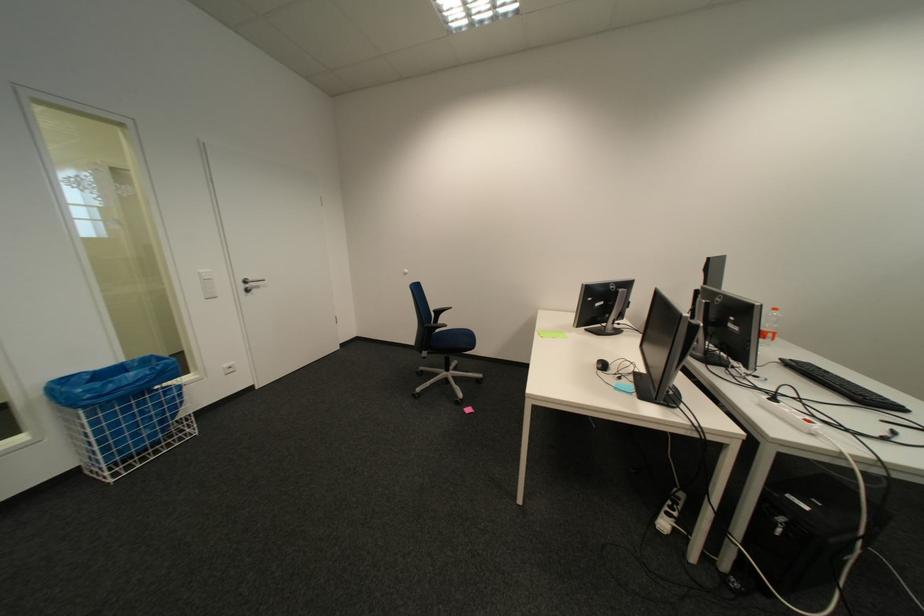
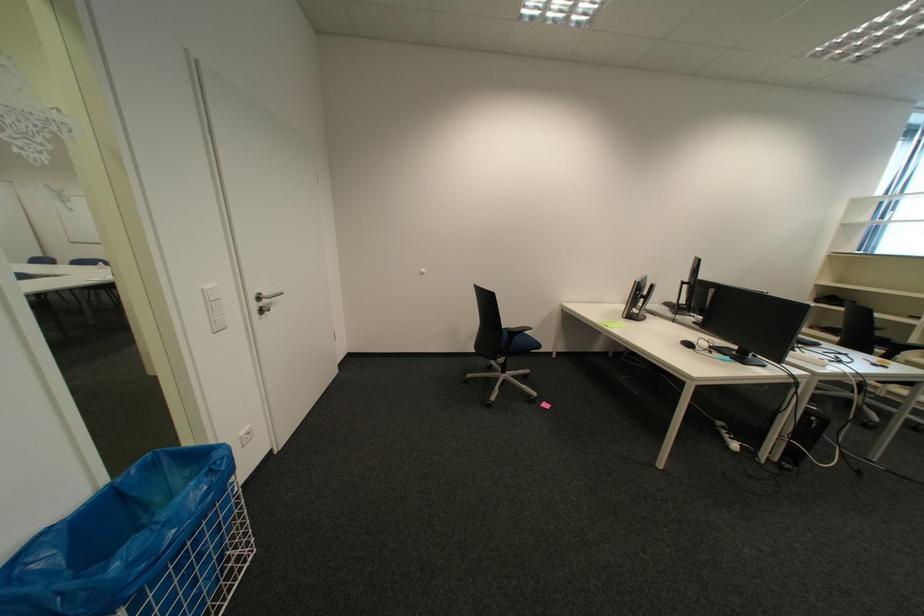
The point at (254, 286) is marked in the first image. Where is the corresponding point in the second image?

(266, 307)